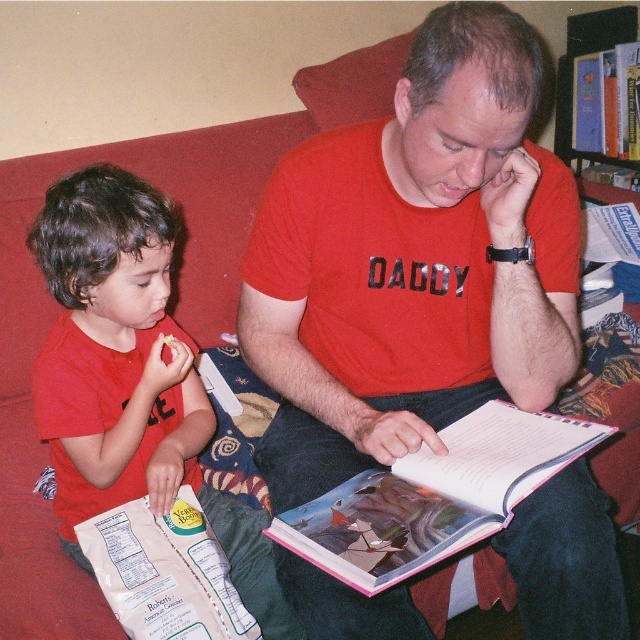
Question: Which of these objects is positioned farthest from the matte red t-shirt at center?

Choices:
 (A) matte red shirt at left
 (B) hardcover book at upper right

Answer: (B)

Question: Where is matte red t-shirt at center located in relation to matte red shirt at left in the image?

Choices:
 (A) left
 (B) right

Answer: (B)

Question: Considering the real-world distances, which object is farthest from the pink paper book at center?

Choices:
 (A) matte red shirt at left
 (B) hardcover book at upper right
 (C) wooden bookshelf at upper right

Answer: (C)

Question: Does hardcover book at upper right appear under wooden bookshelf at upper right?

Choices:
 (A) no
 (B) yes

Answer: (B)

Question: Is matte red shirt at left bigger than hardcover book at upper right?

Choices:
 (A) yes
 (B) no

Answer: (A)

Question: Which point is farther from the camera taking this photo?

Choices:
 (A) (564, 70)
 (B) (74, 356)
 (C) (474, 189)
 (D) (625, 54)

Answer: (A)